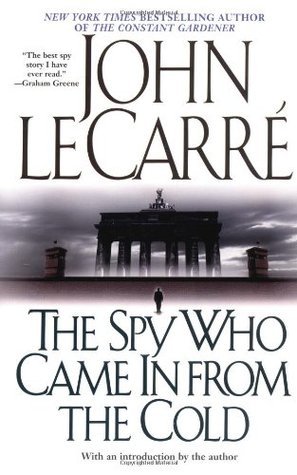
This screenshot has height=475, width=297. I want to click on statue, so click(x=156, y=204).